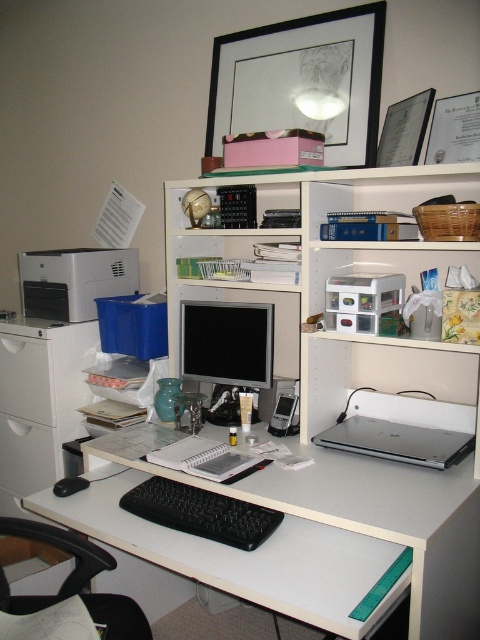
What are the coordinates of the black plastic calculator at center?

The black plastic calculator at center is located at coordinates point (236, 208).

You are setting up your home office and want to place both the matte black monitor at center and the silver metallic laptop at center on the desk. Given their sizes, which one should you place first to ensure they both fit comfortably?

The matte black monitor at center is bigger than the silver metallic laptop at center, so you should place the matte black monitor at center first to ensure there is enough space for both devices.

You are standing in front of the desk and want to reach two points in the scene. The first point is at coordinate point(259, 326) and the second is at point(207, 525). Which point is closer to you?

Point(259, 326) is further to the camera than point(207, 525), so the point closer to you is point(207, 525).